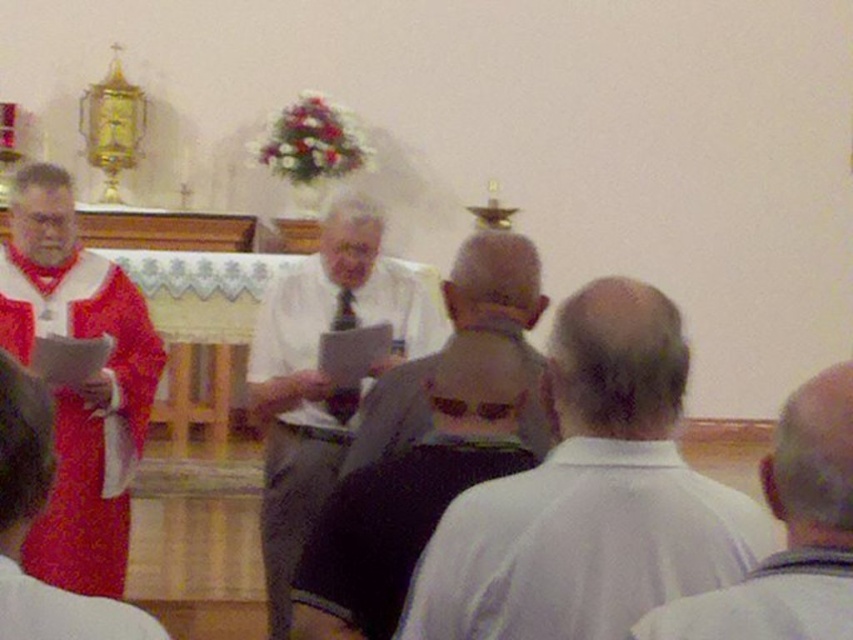
Question: Which of these objects is positioned closest to the matte red robe at lower left?

Choices:
 (A) gray fabric shirt at center
 (B) white matte shirt at center
 (C) white paper at center

Answer: (A)

Question: Considering the real-world distances, which object is closest to the white paper at center?

Choices:
 (A) gray fabric shirt at center
 (B) dark gray textured shirt at center

Answer: (B)

Question: Does dark gray textured shirt at center have a larger size compared to white matte shirt at center?

Choices:
 (A) yes
 (B) no

Answer: (A)

Question: Can you confirm if gray fabric shirt at center is positioned below white matte shirt at center?

Choices:
 (A) yes
 (B) no

Answer: (A)

Question: Where is dark gray textured shirt at center located in relation to white matte shirt at center in the image?

Choices:
 (A) below
 (B) above

Answer: (A)

Question: Which point is farther to the camera?

Choices:
 (A) (792, 576)
 (B) (589, 403)
 (C) (334, 460)
 (D) (807, 392)

Answer: (C)